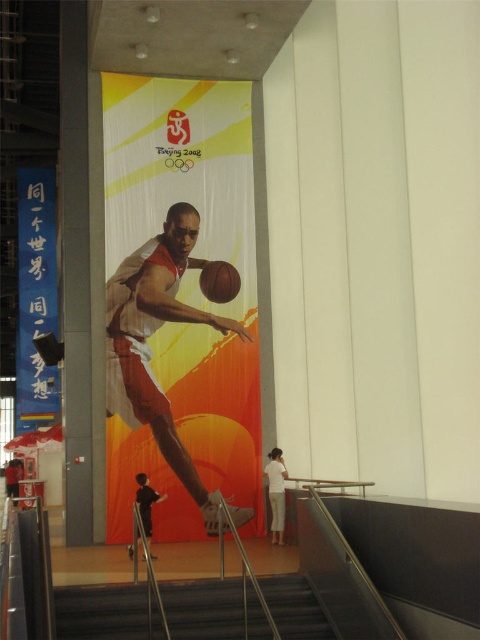
Who is shorter, matte white banner at upper center or rubber/leather basketball at center?

With less height is rubber/leather basketball at center.

Measure the distance between point (45, 244) and camera.

Point (45, 244) and camera are 42.88 meters apart from each other.

Who is more forward, (x=41, y=173) or (x=212, y=280)?

Point (x=212, y=280)

Identify the location of matte white banner at upper center. This screenshot has height=640, width=480. (36, 296).

From the picture: Does matte white basketball player at center come in front of dark gray concrete stairs at lower center?

No, it is behind dark gray concrete stairs at lower center.

Does matte white basketball player at center appear over dark gray concrete stairs at lower center?

Yes.

Find the location of a particular element. The height and width of the screenshot is (640, 480). matte white basketball player at center is located at coordinates click(x=147, y=344).

Is dark gray concrete stairs at lower center positioned behind rubber/leather basketball at center?

No, it is in front of rubber/leather basketball at center.

Does dark gray concrete stairs at lower center appear on the left side of rubber/leather basketball at center?

Correct, you'll find dark gray concrete stairs at lower center to the left of rubber/leather basketball at center.

Is point (193, 634) positioned before point (220, 296)?

Yes, it is.

Identify the location of dark gray concrete stairs at lower center. (101, 611).